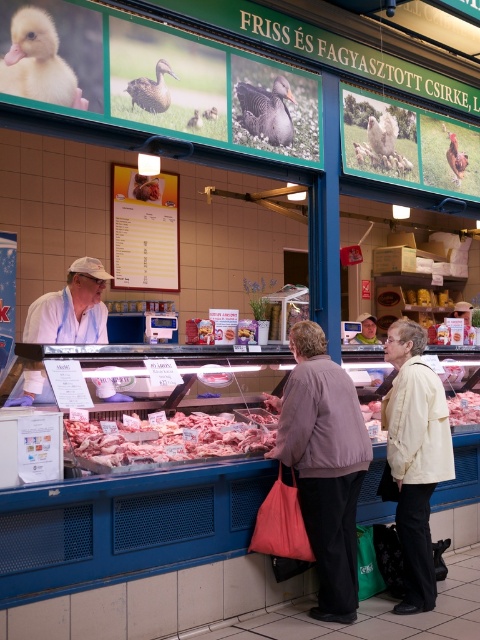
Can you confirm if pinkish raw meat at center is smaller than pink glossy meat at center?

No, pinkish raw meat at center is not smaller than pink glossy meat at center.

Consider the image. Is pinkish raw meat at center wider than pink glossy meat at center?

Indeed, pinkish raw meat at center has a greater width compared to pink glossy meat at center.

Between point (164, 460) and point (472, 413), which one is positioned behind?

Positioned behind is point (472, 413).

Where is `pinkish raw meat at center`? pinkish raw meat at center is located at coordinates (169, 436).

Is light beige jacket at lower right smaller than pink glossy meat at center?

Incorrect, light beige jacket at lower right is not smaller in size than pink glossy meat at center.

Does light beige jacket at lower right lie behind pink glossy meat at center?

No, light beige jacket at lower right is in front of pink glossy meat at center.

Measure the distance between light beige jacket at lower right and camera.

light beige jacket at lower right and camera are 3.71 meters apart from each other.

Identify the location of light beige jacket at lower right. (415, 456).

Can you confirm if light beige jacket at center is wider than pink glossy meat at center?

Yes.

Which is more to the right, light beige jacket at center or pink glossy meat at center?

pink glossy meat at center is more to the right.

Where is `light beige jacket at center`? The height and width of the screenshot is (640, 480). light beige jacket at center is located at coordinates (415, 458).